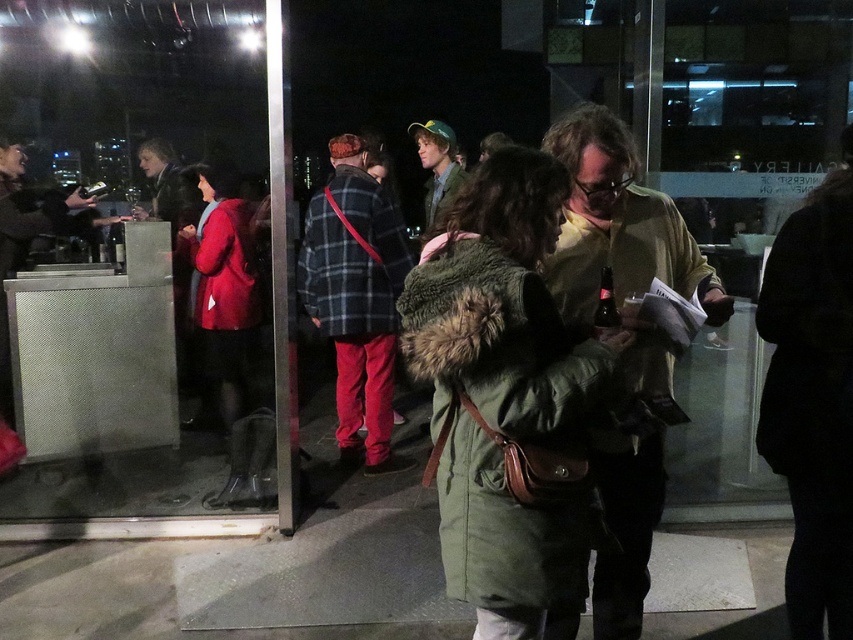
You are at the event and want to take a photo of both the person in the green coat and the person holding a bottle. Which of the two points, point [483,605] or point [361,316], should you focus on to ensure both subjects are in sharp focus?

You should focus on point [483,605] because it is closer to the camera than point [361,316], ensuring both subjects are within the depth of field.

You are at a nighttime event and want to locate the green fuzzy coat at center. What are the coordinates where you should look?

The green fuzzy coat at center is located at coordinates point (x=506, y=397).